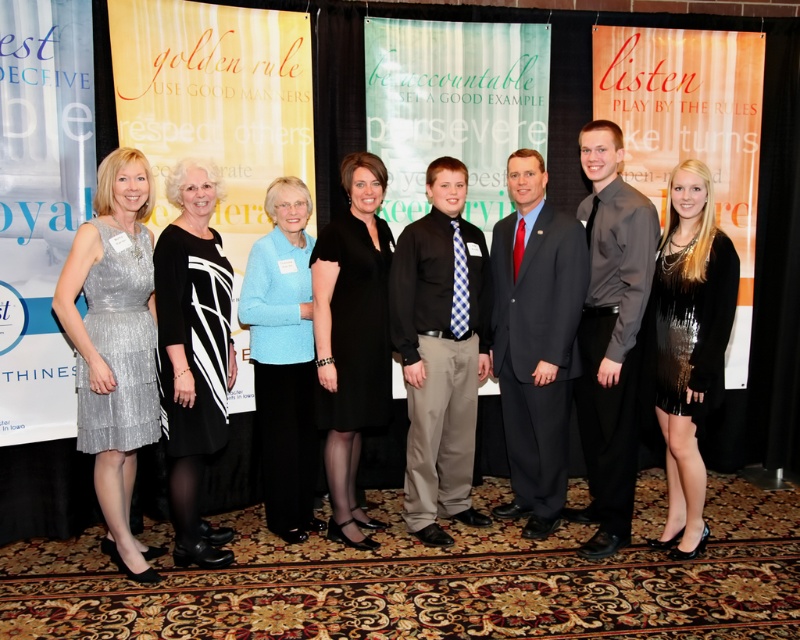
Question: Does dark gray suit at center lie in front of matte gray shirt at center?

Choices:
 (A) yes
 (B) no

Answer: (B)

Question: Which of the following is the closest to the observer?

Choices:
 (A) (286, 371)
 (B) (170, 248)
 (C) (90, 392)
 (D) (692, 234)

Answer: (C)

Question: Does black and white dress at center have a larger size compared to black satin dress at center?

Choices:
 (A) no
 (B) yes

Answer: (B)

Question: Which point is farther to the camera?

Choices:
 (A) tap(218, 237)
 (B) tap(628, 282)
 (C) tap(244, 300)

Answer: (C)

Question: Among these objects, which one is farthest from the camera?

Choices:
 (A) light blue sweater at center
 (B) black satin dress at center

Answer: (A)

Question: Can you confirm if matte gray shirt at center is thinner than light blue sweater at center?

Choices:
 (A) yes
 (B) no

Answer: (A)